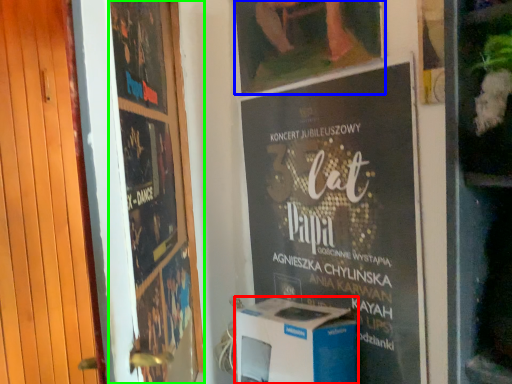
Question: Based on their relative distances, which object is farther from appliance (highlighted by a red box)? Choose from picture frame (highlighted by a blue box) and poster (highlighted by a green box).

Choices:
 (A) picture frame
 (B) poster

Answer: (A)